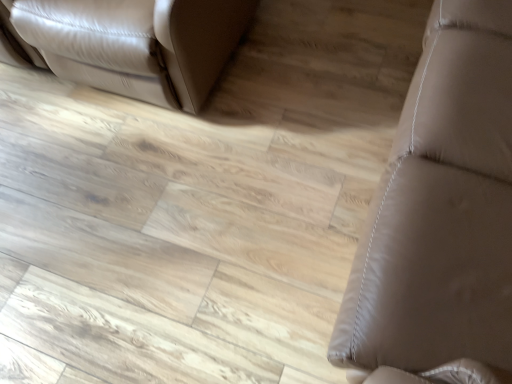
Question: In the image, is matte leather couch at upper left, the first furniture in the left-to-right sequence, positioned in front of or behind brown leather couch at right, which is the 1th furniture from right to left?

Choices:
 (A) front
 (B) behind

Answer: (B)

Question: From a real-world perspective, relative to brown leather couch at right, which is the 1th furniture from right to left, is matte leather couch at upper left, which is counted as the 2th furniture, starting from the right, vertically above or below?

Choices:
 (A) above
 (B) below

Answer: (B)

Question: Visually, is matte leather couch at upper left, the first furniture in the left-to-right sequence, positioned to the left or to the right of brown leather couch at right, which is the 1th furniture from right to left?

Choices:
 (A) right
 (B) left

Answer: (B)

Question: Do you think brown leather couch at right, which is the 1th furniture from right to left, is within matte leather couch at upper left, which is counted as the 2th furniture, starting from the right, or outside of it?

Choices:
 (A) outside
 (B) inside

Answer: (A)

Question: From the image's perspective, is brown leather couch at right, the second furniture from the left, positioned above or below matte leather couch at upper left, the first furniture in the left-to-right sequence?

Choices:
 (A) below
 (B) above

Answer: (A)

Question: Is point (352, 297) closer or farther from the camera than point (105, 59)?

Choices:
 (A) closer
 (B) farther

Answer: (A)

Question: In terms of size, does brown leather couch at right, the second furniture from the left, appear bigger or smaller than matte leather couch at upper left, which is counted as the 2th furniture, starting from the right?

Choices:
 (A) small
 (B) big

Answer: (B)